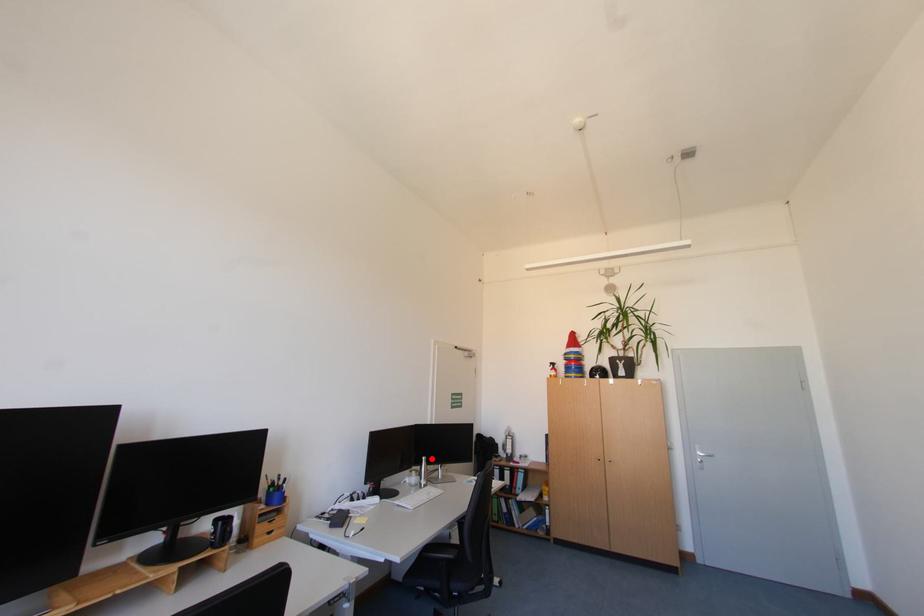
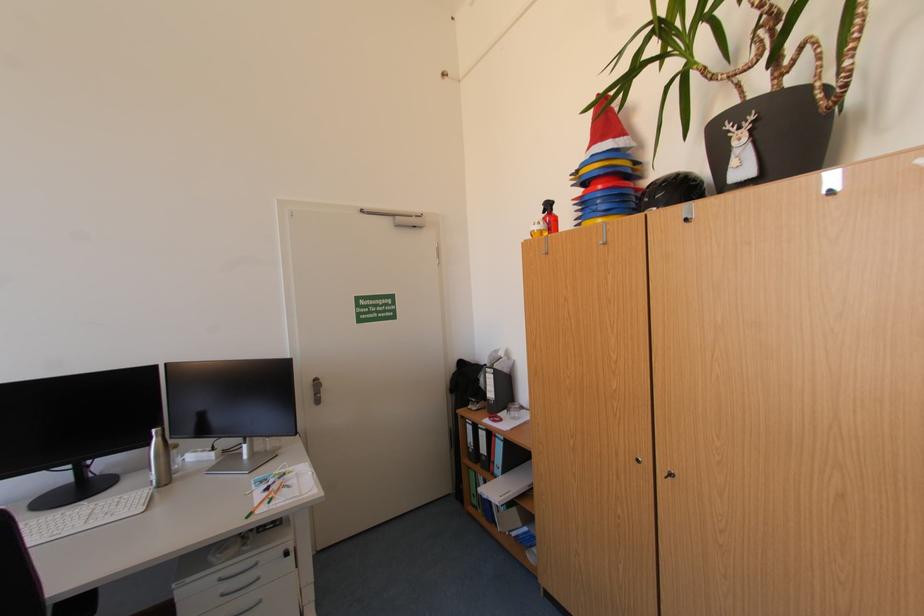
Question: I am providing you with two images of the same scene from different viewpoints. Given a red point in image1, look at the same physical point in image2. Is it:

Choices:
 (A) Closer to the viewpoint
 (B) Farther from the viewpoint

Answer: (A)